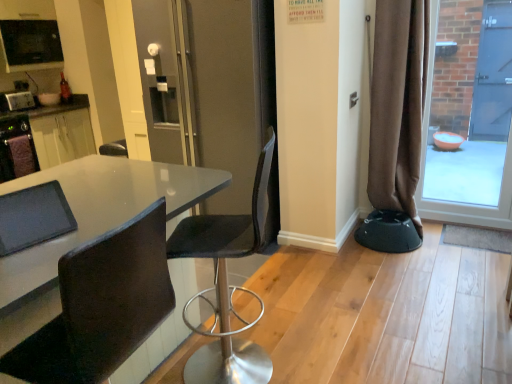
Question: Is matte black table at left taller or shorter than brushed metal toaster at left, which is the 1th appliance from bottom to top?

Choices:
 (A) tall
 (B) short

Answer: (A)

Question: From a real-world perspective, is matte black table at left above or below brushed metal toaster at left, which is the 1th appliance from bottom to top?

Choices:
 (A) above
 (B) below

Answer: (B)

Question: Estimate the real-world distances between objects in this image. Which object is farther from the brown fabric curtain at right?

Choices:
 (A) brushed metal toaster at left, which is the 1th appliance from bottom to top
 (B) black mesh chair at center, positioned as the first chair in back-to-front order
 (C) black plastic bar stool at lower right
 (D) matte black screen door at center
 (E) matte black table at left

Answer: (A)

Question: Which object is positioned farthest from the matte black table at left?

Choices:
 (A) transparent glass door at right
 (B) matte black screen door at center
 (C) black mesh chair at center, which appears as the second chair when viewed from the front
 (D) black glossy microwave at upper left, acting as the 2th appliance starting from the bottom
 (E) brown fabric curtain at right

Answer: (A)